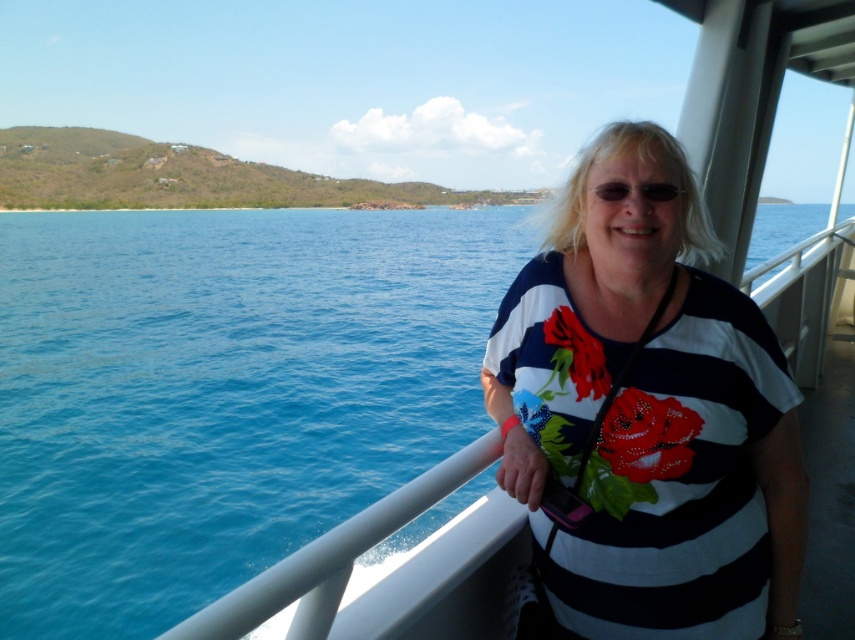
You are the person on the boat looking straight ahead. You notice the blue water at center and the black plastic sunglasses at center. Which object is located to your left?

The blue water at center is positioned on the left side of black plastic sunglasses at center, so the blue water at center is to your left.

You are on a boat and want to take a photo of the blue water at center. Where should you point your camera to capture it?

You should point your camera towards the center of the boat deck at coordinates approximately 0.613 on the horizontal axis and 0.258 on the vertical axis to capture the blue water at center.